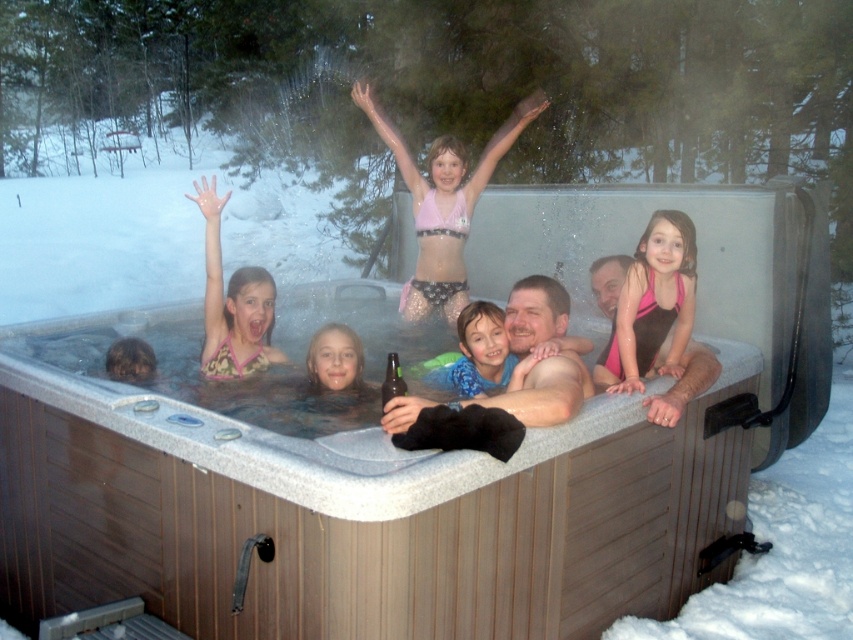
Is wooden hot tub at center taller than pink swimsuit at upper right?

Indeed, wooden hot tub at center has a greater height compared to pink swimsuit at upper right.

Between wooden hot tub at center and pink swimsuit at upper right, which one has more height?

wooden hot tub at center is taller.

Is point (135, 512) less distant than point (689, 278)?

Yes.

The width and height of the screenshot is (853, 640). Identify the location of wooden hot tub at center. (393, 474).

Can you confirm if pink fabric swimsuit at center is thinner than green glass bottle at center?

No.

Is pink fabric swimsuit at center smaller than green glass bottle at center?

No, pink fabric swimsuit at center is not smaller than green glass bottle at center.

Does point (248, 273) come closer to viewer compared to point (398, 365)?

That is False.

This screenshot has width=853, height=640. Identify the location of pink fabric swimsuit at center. (233, 304).

Measure the distance between pink fabric bikini at upper center and camera.

4.63 meters

Does pink fabric bikini at upper center have a lesser height compared to blue patterned shirt at center?

No.

Is point (430, 218) positioned before point (457, 364)?

That is False.

I want to click on pink fabric bikini at upper center, so click(x=444, y=204).